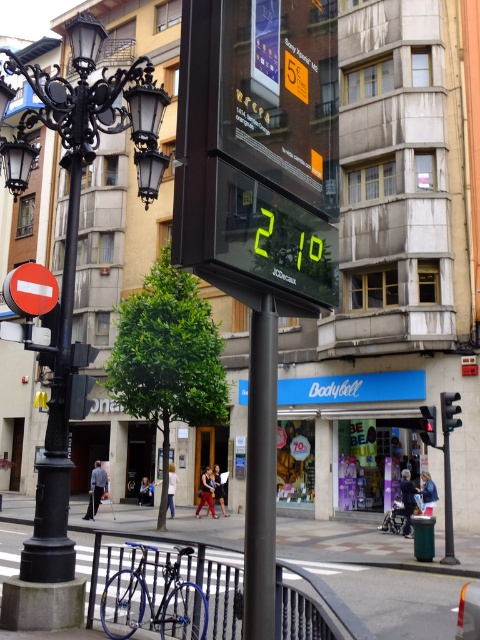
Question: Where is black wrought iron streetlight at left located in relation to white plastic traffic sign at left in the image?

Choices:
 (A) right
 (B) left

Answer: (B)

Question: Based on their relative distances, which object is farther from the black wrought iron streetlight at left?

Choices:
 (A) white plastic traffic sign at left
 (B) black plastic pole at center
 (C) red glass traffic light at center
 (D) black matte pole at center

Answer: (C)

Question: Which of the following is the farthest from the observer?

Choices:
 (A) (455, 400)
 (B) (305, 429)
 (C) (272, 362)
 (D) (16, 164)

Answer: (B)

Question: Which of the following is the closest to the observer?

Choices:
 (A) (255, 435)
 (B) (431, 435)
 (C) (342, 435)
 (D) (16, 273)

Answer: (A)

Question: Observing the image, what is the correct spatial positioning of black wrought iron streetlight at left in reference to black matte pole at center?

Choices:
 (A) above
 (B) below

Answer: (A)

Question: Where is black matte pole at center located in relation to black plastic traffic light at center in the image?

Choices:
 (A) below
 (B) above

Answer: (B)